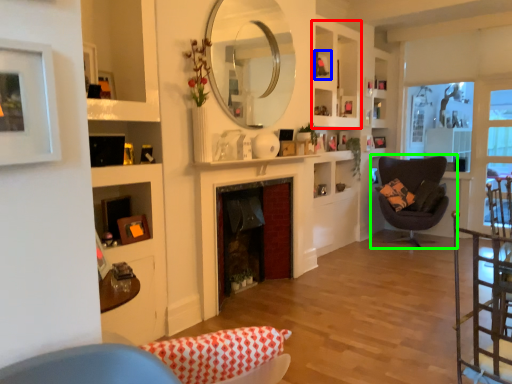
Question: Which object is positioned closest to cabinet (highlighted by a red box)? Select from picture frame (highlighted by a blue box) and chair (highlighted by a green box).

Choices:
 (A) picture frame
 (B) chair

Answer: (A)